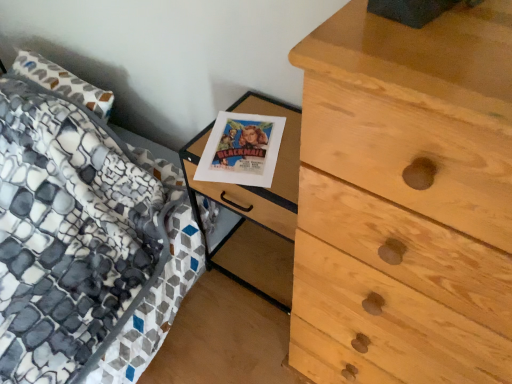
Question: Considering the relative sizes of patterned fabric bed at left and wooden nightstand at center in the image provided, is patterned fabric bed at left thinner than wooden nightstand at center?

Choices:
 (A) no
 (B) yes

Answer: (A)

Question: From the image's perspective, is patterned fabric bed at left above wooden nightstand at center?

Choices:
 (A) yes
 (B) no

Answer: (A)

Question: Does patterned fabric bed at left turn towards wooden nightstand at center?

Choices:
 (A) no
 (B) yes

Answer: (A)

Question: Does patterned fabric bed at left have a larger size compared to wooden nightstand at center?

Choices:
 (A) no
 (B) yes

Answer: (B)

Question: Does patterned fabric bed at left contain wooden nightstand at center?

Choices:
 (A) no
 (B) yes

Answer: (B)

Question: From the image's perspective, is wooden nightstand at center positioned above or below light brown wood chest of drawers at right?

Choices:
 (A) above
 (B) below

Answer: (A)

Question: Based on their positions, is wooden nightstand at center located to the left or right of light brown wood chest of drawers at right?

Choices:
 (A) left
 (B) right

Answer: (A)

Question: Considering the positions of wooden nightstand at center and light brown wood chest of drawers at right in the image, is wooden nightstand at center wider or thinner than light brown wood chest of drawers at right?

Choices:
 (A) wide
 (B) thin

Answer: (B)

Question: Considering their positions, is wooden nightstand at center located in front of or behind light brown wood chest of drawers at right?

Choices:
 (A) behind
 (B) front

Answer: (A)

Question: Relative to wooden nightstand at center, is light brown wood chest of drawers at right in front or behind?

Choices:
 (A) behind
 (B) front

Answer: (B)

Question: Choose the correct answer: Is light brown wood chest of drawers at right inside wooden nightstand at center or outside it?

Choices:
 (A) outside
 (B) inside

Answer: (A)

Question: Is light brown wood chest of drawers at right taller or shorter than wooden nightstand at center?

Choices:
 (A) short
 (B) tall

Answer: (B)

Question: From the image's perspective, is light brown wood chest of drawers at right located above or below wooden nightstand at center?

Choices:
 (A) below
 (B) above

Answer: (A)

Question: In terms of height, does light brown wood chest of drawers at right look taller or shorter compared to patterned fabric bed at left?

Choices:
 (A) short
 (B) tall

Answer: (B)

Question: Does point (295, 276) appear closer or farther from the camera than point (81, 193)?

Choices:
 (A) farther
 (B) closer

Answer: (B)